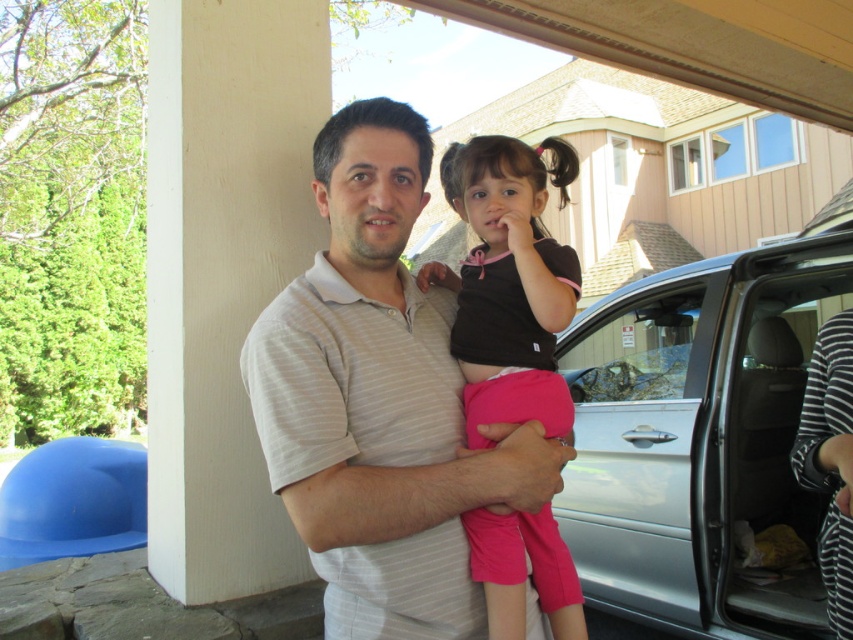
You are designing a clothing catalog and need to place the striped cotton shirt at center and the black matte shirt at center next to each other. Which shirt should be placed first if you want the larger one to be on the left side?

The striped cotton shirt at center is larger than the black matte shirt at center, so place the striped cotton shirt at center first on the left side.

You are a photographer trying to capture a photo of the silver metallic car at right and the black matte shirt at center. Based on their positions, which object should be placed lower in the frame to maintain proper alignment?

The silver metallic car at right should be placed lower in the frame because it is positioned below the black matte shirt at center according to the description.